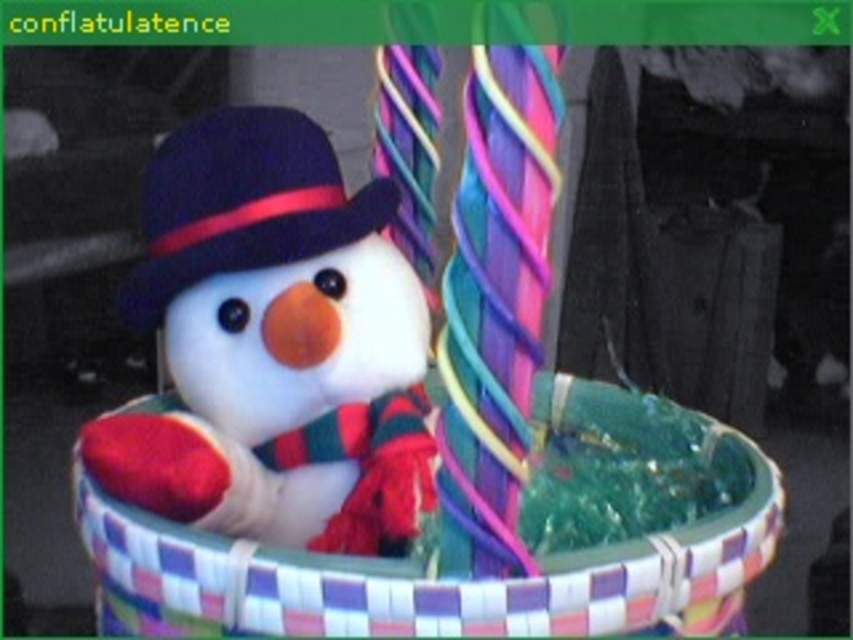
At what (x,y) coordinates should I click in order to perform the action: click on white plush snowman at center. Please return your answer as a coordinate pair (x, y). Looking at the image, I should click on (274, 346).

Between white plush snowman at center and velvet-like dark blue dress hat at upper left, which one appears on the left side from the viewer's perspective?

Positioned to the left is velvet-like dark blue dress hat at upper left.

Identify the location of white plush snowman at center. (274, 346).

Is point (396, 582) in front of point (219, 182)?

Yes, point (396, 582) is in front of point (219, 182).

Measure the distance between point (248, 618) and camera.

A distance of 18.19 inches exists between point (248, 618) and camera.

What do you see at coordinates (460, 577) in the screenshot? Image resolution: width=853 pixels, height=640 pixels. I see `woven fabric basket at center` at bounding box center [460, 577].

This screenshot has height=640, width=853. Identify the location of woven fabric basket at center. (460, 577).

Measure the distance between white plush snowman at center and woven fabric basket at center.

3.80 inches

Does point (291, 433) lie behind point (300, 570)?

Yes, point (291, 433) is behind point (300, 570).

What are the coordinates of `white plush snowman at center` in the screenshot? It's located at (274, 346).